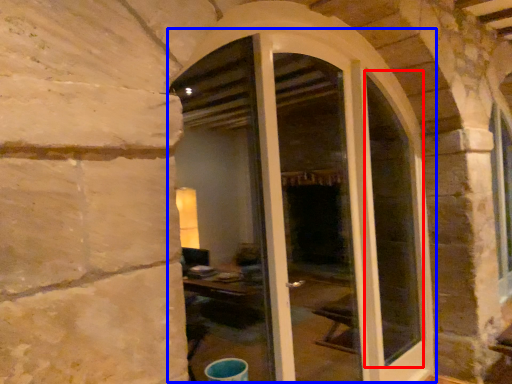
Question: Which object is closer to the camera taking this photo, glass window (highlighted by a red box) or door (highlighted by a blue box)?

Choices:
 (A) glass window
 (B) door

Answer: (B)